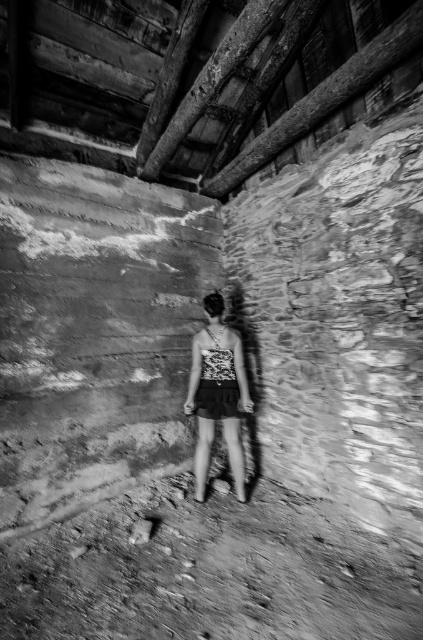
You are standing at the point marked as point (208,572) in the old building. What is the surface you are standing on?

The point (208,572) is on dirt track at lower center, so you are standing on a dirt track.

You are a photographer trying to capture the printed fabric tank top at center in the foreground while including the dirt track at lower center in the background. Given the camera you have can only focus on objects within 30 inches of each other, will you be able to achieve this composition?

The distance between the dirt track at lower center and the printed fabric tank top at center is 34.02 inches, which exceeds the camera focus range of 30 inches. Therefore, you won t be able to have both in focus simultaneously.

You are a photographer trying to capture the dirt track at lower center and the printed fabric tank top at center in the same frame. Which object should you zoom in on to ensure both are visible without cropping?

The dirt track at lower center is wider than the printed fabric tank top at center, so you should zoom out to include both objects in the frame.